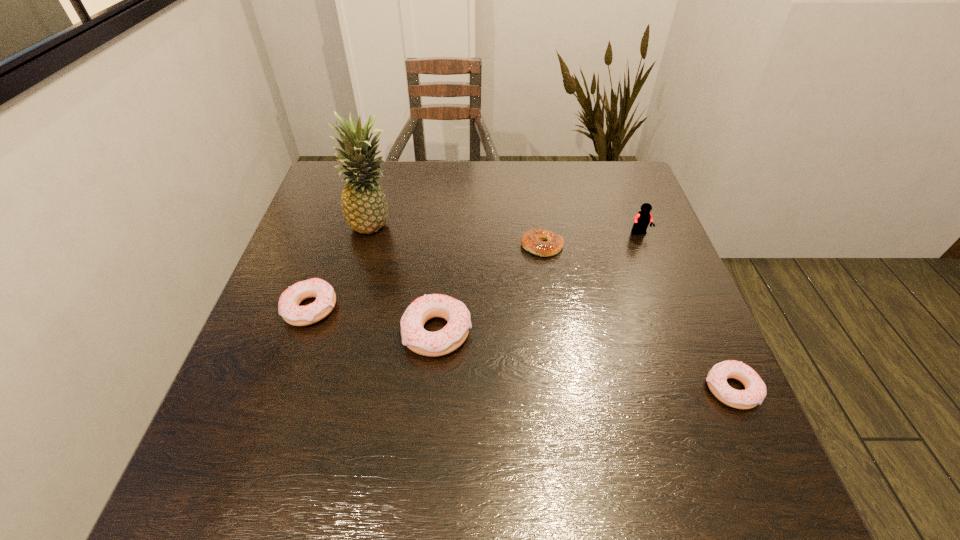
Identify which doughnut is the closest to the second shortest doughnut. Please provide its 2D coordinates. Your answer should be formatted as a tuple, i.e. [(x, y)], where the tuple contains the x and y coordinates of a point satisfying the conditions above.

[(414, 336)]

Select which doughnut appears as the second closest to the leftmost doughnut. Please provide its 2D coordinates. Your answer should be formatted as a tuple, i.e. [(x, y)], where the tuple contains the x and y coordinates of a point satisfying the conditions above.

[(755, 389)]

What are the coordinates of `free spot that satisfies the following two spatial constraints: 1. on the front side of the third tallest object; 2. on the right side of the third shortest object` in the screenshot? It's located at (303, 333).